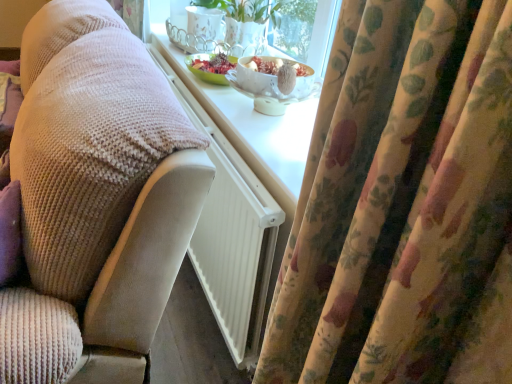
Question: Should I look upward or downward to see pink corduroy couch at left?

Choices:
 (A) down
 (B) up

Answer: (B)